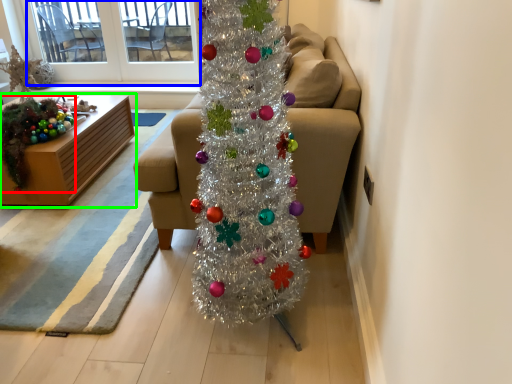
Question: Which object is positioned farthest from christmas decoration (highlighted by a red box)? Select from window screen (highlighted by a blue box) and furniture (highlighted by a green box).

Choices:
 (A) window screen
 (B) furniture

Answer: (A)